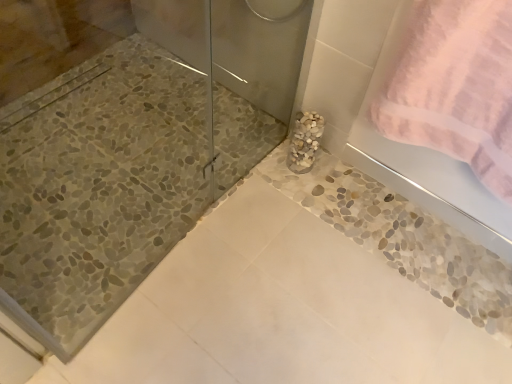
Question: Does pink terry cloth towel at upper right have a greater width compared to white pebble vase at center?

Choices:
 (A) no
 (B) yes

Answer: (B)

Question: Are pink terry cloth towel at upper right and white pebble vase at center beside each other?

Choices:
 (A) no
 (B) yes

Answer: (A)

Question: From a real-world perspective, is pink terry cloth towel at upper right on white pebble vase at center?

Choices:
 (A) yes
 (B) no

Answer: (A)

Question: Is pink terry cloth towel at upper right behind white pebble vase at center?

Choices:
 (A) yes
 (B) no

Answer: (B)

Question: Does pink terry cloth towel at upper right have a smaller size compared to white pebble vase at center?

Choices:
 (A) yes
 (B) no

Answer: (B)

Question: Does pink terry cloth towel at upper right contain white pebble vase at center?

Choices:
 (A) yes
 (B) no

Answer: (B)

Question: Is white pebble vase at center shorter than pink terry cloth towel at upper right?

Choices:
 (A) yes
 (B) no

Answer: (A)

Question: Is white pebble vase at center oriented away from pink terry cloth towel at upper right?

Choices:
 (A) yes
 (B) no

Answer: (B)

Question: From the image's perspective, would you say white pebble vase at center is positioned over pink terry cloth towel at upper right?

Choices:
 (A) no
 (B) yes

Answer: (A)

Question: Is white pebble vase at center wider than pink terry cloth towel at upper right?

Choices:
 (A) yes
 (B) no

Answer: (B)

Question: From a real-world perspective, is white pebble vase at center over pink terry cloth towel at upper right?

Choices:
 (A) no
 (B) yes

Answer: (A)

Question: Are white pebble vase at center and pink terry cloth towel at upper right far apart?

Choices:
 (A) no
 (B) yes

Answer: (A)

Question: In terms of width, does pink terry cloth towel at upper right look wider or thinner when compared to white pebble vase at center?

Choices:
 (A) wide
 (B) thin

Answer: (A)